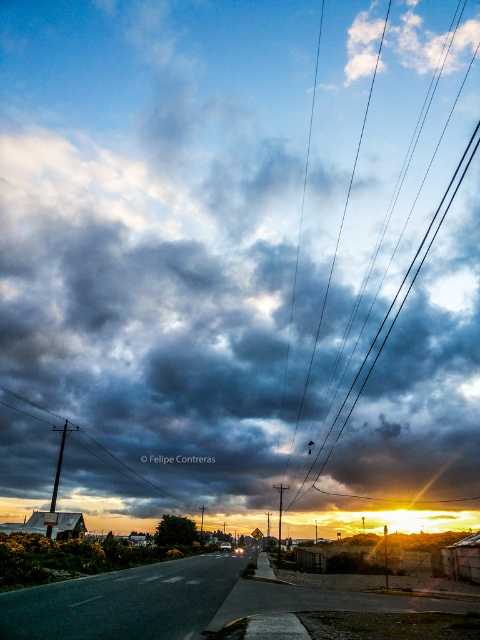
You are driving along the road and notice two objects in the scene. Which one is closer to you, the black wire at upper center or the dark gray wooden pole at left?

The black wire at upper center is closer to you because it is further to the viewer than the dark gray wooden pole at left.

You are driving a car that is 18 feet long. You see the black wire at upper center and the smooth metallic pole at center. If you want to park your car between them, will there be enough space?

The black wire at upper center is 235.31 feet from the smooth metallic pole at center. Since your car is only 18 feet long, there is more than enough space to park between them.

You are driving on the road and see the dark gray wooden pole at left and the smooth metallic pole at center. Which pole is closer to the road?

The dark gray wooden pole at left is positioned over the smooth metallic pole at center, meaning it is closer to the road.